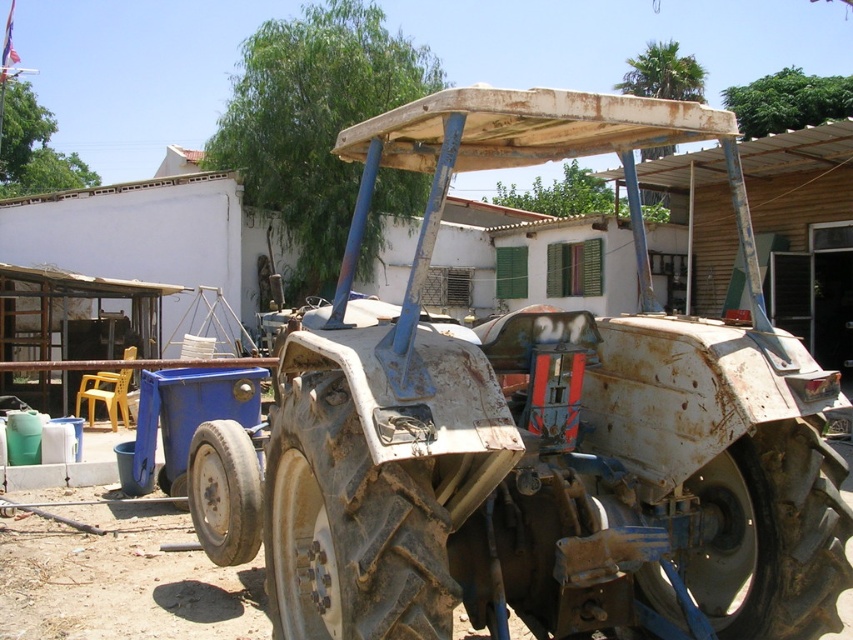
Does rusty metal tire at lower left have a larger size compared to rusty metal tire at lower center?

Correct, rusty metal tire at lower left is larger in size than rusty metal tire at lower center.

Looking at this image, between rusty metal tire at lower left and rusty metal tire at lower center, which one appears on the left side from the viewer's perspective?

rusty metal tire at lower center

Image resolution: width=853 pixels, height=640 pixels. What are the coordinates of `rusty metal tire at lower left` in the screenshot? It's located at (224, 492).

The height and width of the screenshot is (640, 853). Identify the location of rusty metal tire at lower left. (224, 492).

Can you confirm if rusty metal tractor at center is bigger than rusty metal tire at lower left?

Yes.

What do you see at coordinates (546, 428) in the screenshot?
I see `rusty metal tractor at center` at bounding box center [546, 428].

Where is `rusty metal tractor at center`? rusty metal tractor at center is located at coordinates (546, 428).

Does dusty rubber tire at center have a lesser height compared to rusty metal tire at lower left?

No, dusty rubber tire at center is not shorter than rusty metal tire at lower left.

Who is more distant from viewer, [352,547] or [254,484]?

Point [254,484]

The height and width of the screenshot is (640, 853). I want to click on dusty rubber tire at center, so click(x=347, y=529).